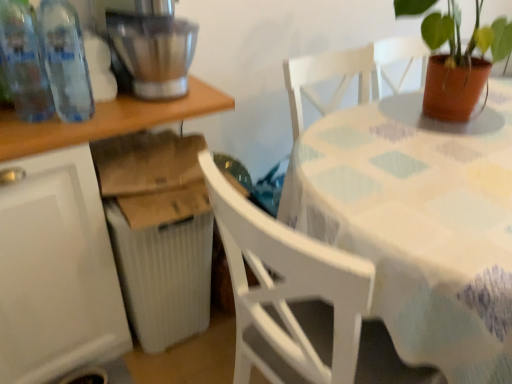
Locate an element on the screen. This screenshot has width=512, height=384. vacant space to the right of transparent plastic bottles at left, the second bottle positioned from the left is located at coordinates coord(130,114).